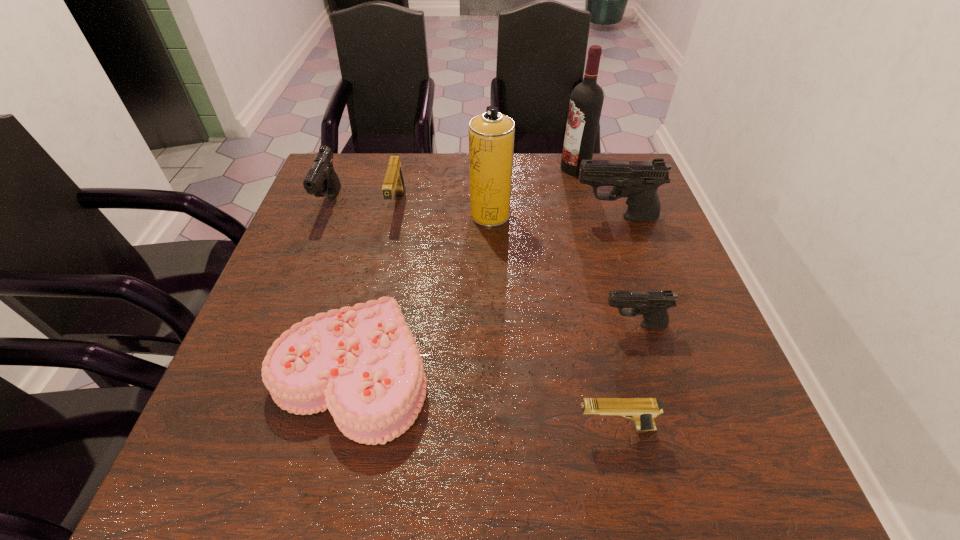
You are a GUI agent. You are given a task and a screenshot of the screen. Output one action in this format:
    pyautogui.click(x=<x>, y=<y>)
    Task: Click on the free space that satisfies the following two spatial constraints: 1. at the barrel of the left tan pistol; 2. on the left side of the second tallest object
    The height and width of the screenshot is (540, 960).
    Given the screenshot: What is the action you would take?
    pyautogui.click(x=396, y=214)

Locate an element on the screen. The image size is (960, 540). free location that satisfies the following two spatial constraints: 1. at the barrel of the leftmost object; 2. on the left side of the second tallest object is located at coordinates (325, 214).

You are a GUI agent. You are given a task and a screenshot of the screen. Output one action in this format:
    pyautogui.click(x=<x>, y=<y>)
    Task: Click on the vacant space that satisfies the following two spatial constraints: 1. on the label of the farthest object; 2. on the front side of the cake
    
    Given the screenshot: What is the action you would take?
    (631, 373)

At what (x,y) coordinates should I click in order to perform the action: click on free space that satisfies the following two spatial constraints: 1. at the barrel of the second nearest pistol; 2. on the front side of the cake. Please return your answer as a coordinate pair (x, y). Image resolution: width=960 pixels, height=540 pixels. Looking at the image, I should click on (649, 373).

Identify the location of vacant space that satisfies the following two spatial constraints: 1. on the label of the wine bottle; 2. on the front side of the fourth object from left to right. (588, 214).